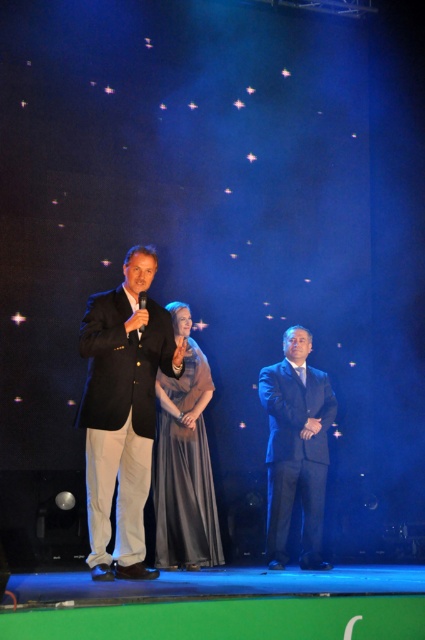
You are a stagehand preparing to adjust the lighting for the performers. You notice two suits on stage, the matte black suit at center and the dark blue suit at center. Which suit requires a larger spotlight to fully illuminate it?

The matte black suit at center requires a larger spotlight because it is bigger than the dark blue suit at center.

You are an event planner trying to arrange the stage layout. You need to place a 1.5m tall decorative column between the matte black suit at center and the shiny black suit at center. Considering their heights, will the column be taller than both suits?

The matte black suit at center has a greater height compared to the shiny black suit at center. Since the column is 1.5m tall, if the matte black suit at center is taller than 1.5m, the column will not be taller than both. However, without specific height measurements for the suits, it is impossible to determine definitively.

You are a photographer positioned behind the stage. You need to capture a photo where both the matte black suit at center and the satin silver dress at center are clearly visible. Given their sizes, which one might require more careful framing to ensure it doesn

The matte black suit at center has a smaller size compared to the satin silver dress at center, so it might require more careful framing to ensure it is clearly visible in the photo.